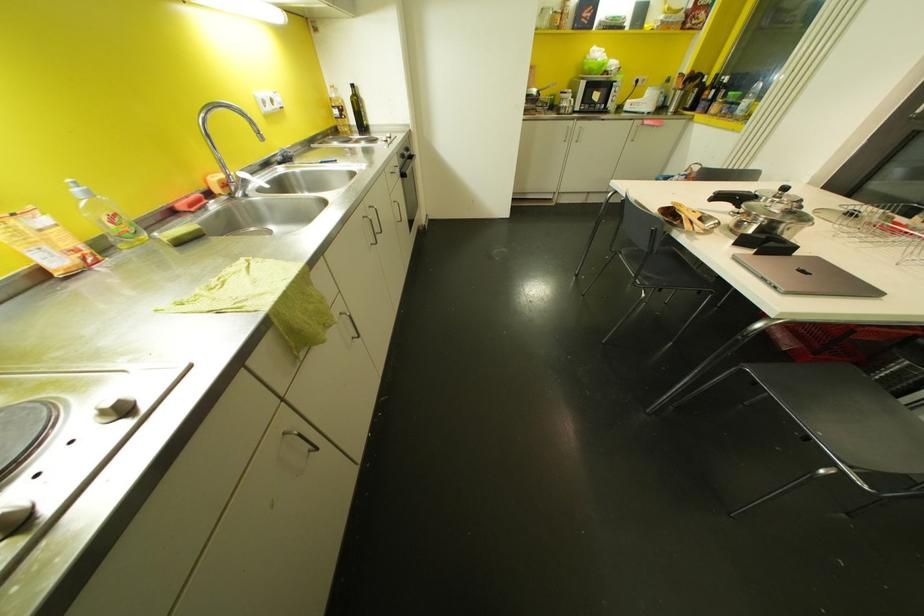
Where would you pull the metal faucet handle? Please return your answer as a coordinate pair (x, y).

(254, 129)